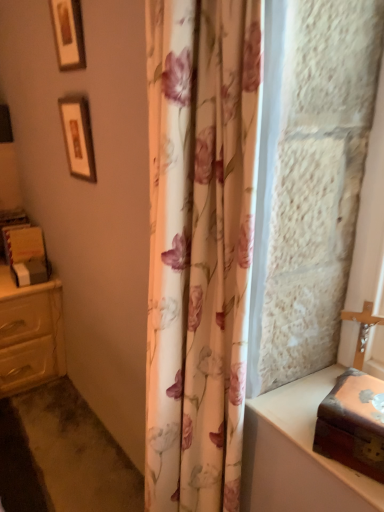
The height and width of the screenshot is (512, 384). I want to click on free spot above wooden box at right (from a real-world perspective), so click(x=362, y=399).